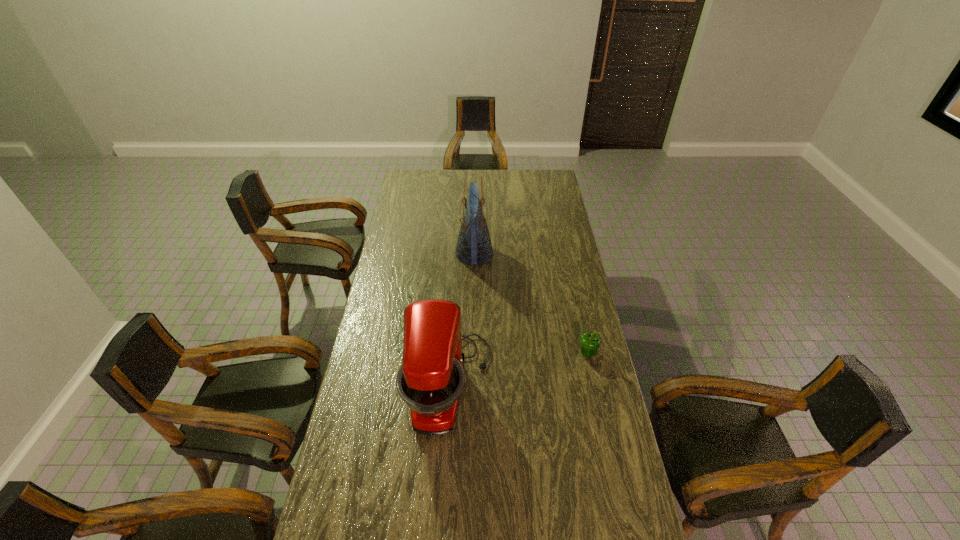
The width and height of the screenshot is (960, 540). Identify the location of free region at the right edge of the desktop. (560, 276).

Where is `free space at the far left corner of the desktop`? Image resolution: width=960 pixels, height=540 pixels. free space at the far left corner of the desktop is located at coordinates (424, 185).

Locate an element on the screen. This screenshot has width=960, height=540. vacant space at the far right corner is located at coordinates (538, 186).

Locate an element on the screen. The width and height of the screenshot is (960, 540). unoccupied position between the shortest object and the farthest object is located at coordinates (531, 303).

At what (x,y) coordinates should I click in order to perform the action: click on vacant space that is in between the kitchen mixer and the farthest object. Please return your answer as a coordinate pair (x, y). Looking at the image, I should click on (462, 320).

You are a GUI agent. You are given a task and a screenshot of the screen. Output one action in this format:
    pyautogui.click(x=<x>, y=<y>)
    Task: Click on the free space between the bell pepper and the kitchen mixer
    The height and width of the screenshot is (540, 960).
    Given the screenshot: What is the action you would take?
    pyautogui.click(x=518, y=369)

Locate an element on the screen. free point between the kitchen mixer and the bell pepper is located at coordinates (518, 369).

In order to click on vacant space that's between the second shortest object and the bell pepper in this screenshot , I will do `click(518, 369)`.

Identify the location of vacant area that lies between the kitchen mixer and the shopping bag. (462, 320).

The width and height of the screenshot is (960, 540). In order to click on vacant space that's between the rightmost object and the farthest object in this screenshot , I will do `click(531, 303)`.